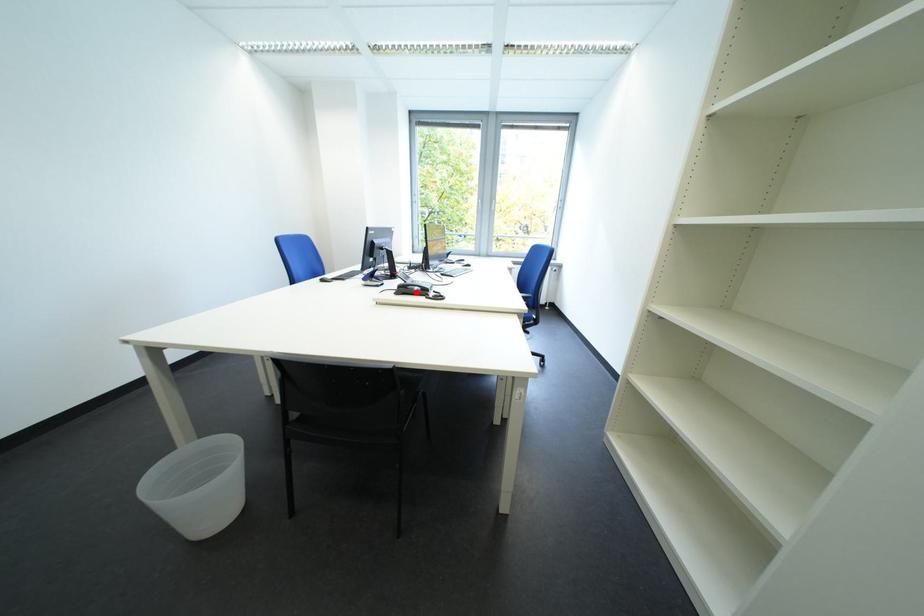
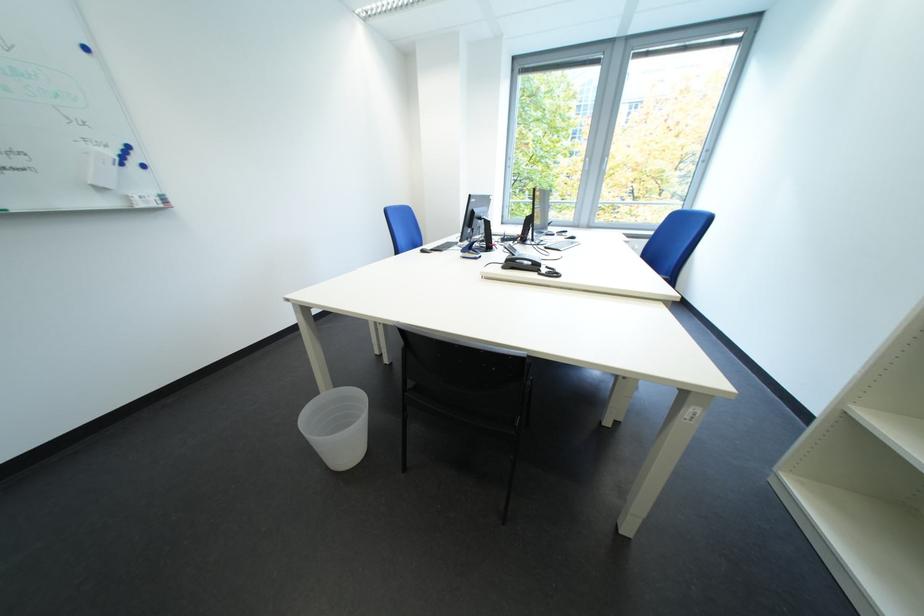
Question: I am providing you with two images of the same scene from different viewpoints. A red point is marked on the first image. Is the red point's position out of view in image 2?

Choices:
 (A) Yes
 (B) No

Answer: (B)